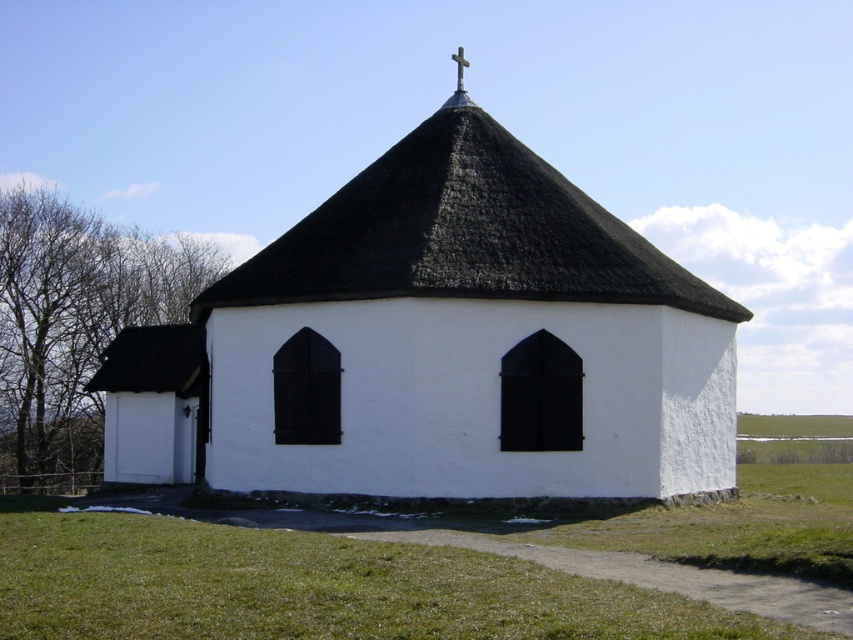
Question: Is white matte church at center to the right of wooden cross at upper center from the viewer's perspective?

Choices:
 (A) yes
 (B) no

Answer: (B)

Question: Is green grass at lower center below metallic cross at upper center?

Choices:
 (A) yes
 (B) no

Answer: (A)

Question: Is thatched roof at center below metallic cross at upper center?

Choices:
 (A) yes
 (B) no

Answer: (A)

Question: Which point is closer to the camera?

Choices:
 (A) white matte church at center
 (B) metallic cross at upper center

Answer: (A)

Question: Among these points, which one is nearest to the camera?

Choices:
 (A) (471, 298)
 (B) (459, 88)
 (C) (456, 68)

Answer: (A)

Question: Which point is farther to the camera?

Choices:
 (A) (259, 280)
 (B) (538, 616)

Answer: (A)